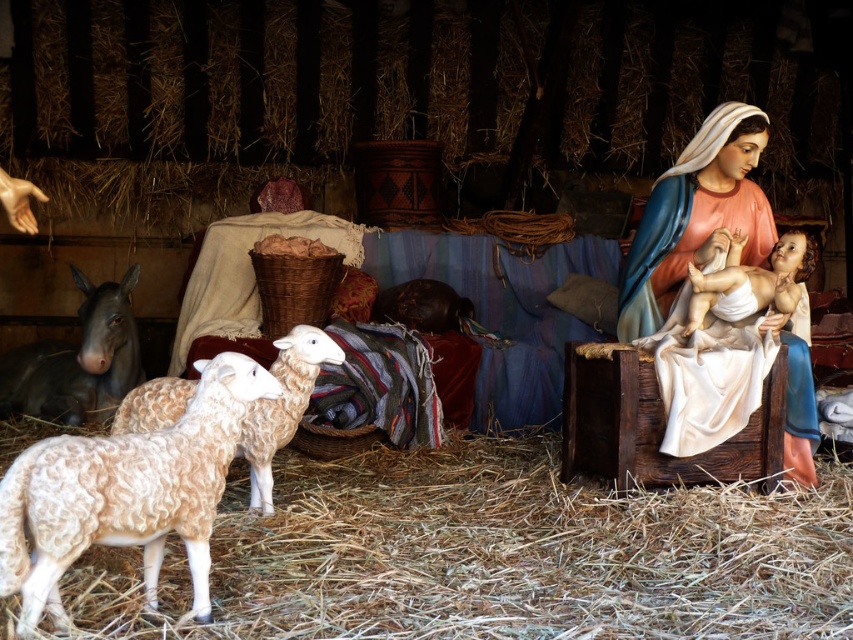
In the nativity scene, there is light brown woolen hay at lower center and fluffy woolen sheep at center. Which object takes up more space in the image?

The light brown woolen hay at lower center takes up more space in the image because it has a larger size compared to the fluffy woolen sheep at center.

You are a toy car that is 1.5 meters long. You want to drive from the fuzzy woolen sheep at lower left to the matte porcelain statue at right. Can you make the journey without needing to turn or stop?

The distance between the fuzzy woolen sheep at lower left and the matte porcelain statue at right is 2.05 meters. Since the toy car is 1.5 meters long, it can travel the distance without needing to turn or stop as there is enough space.

You are setting up a Christmas display and want to place the fuzzy woolen sheep at lower left and the matte porcelain statue at right in a way that aligns with their original positions. Which object should be placed to the left of the other?

The fuzzy woolen sheep at lower left should be placed to the left of the matte porcelain statue at right because the fuzzy woolen sheep at lower left is positioned on the left side of matte porcelain statue at right.